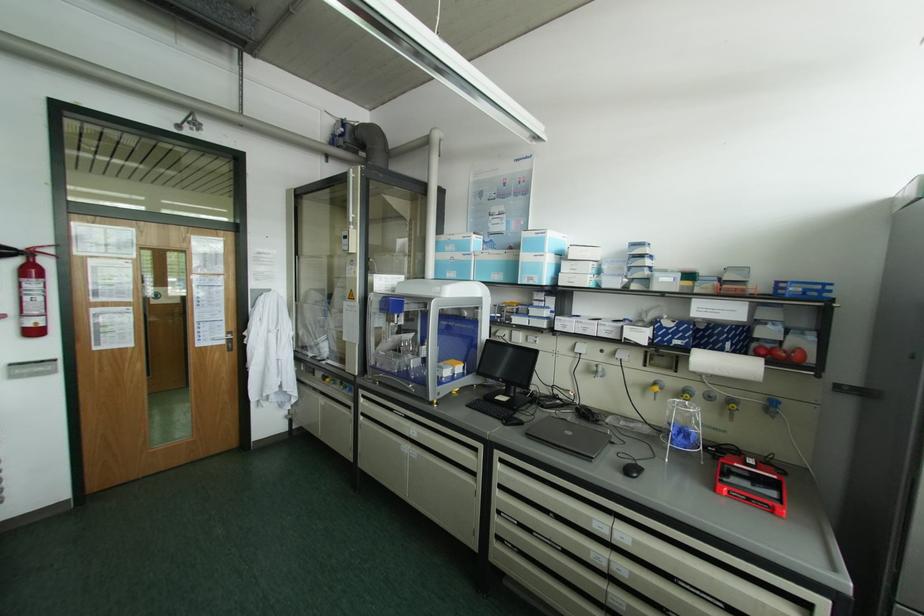
Locate an element on the screen. This screenshot has height=616, width=924. red machine lid is located at coordinates (751, 483).